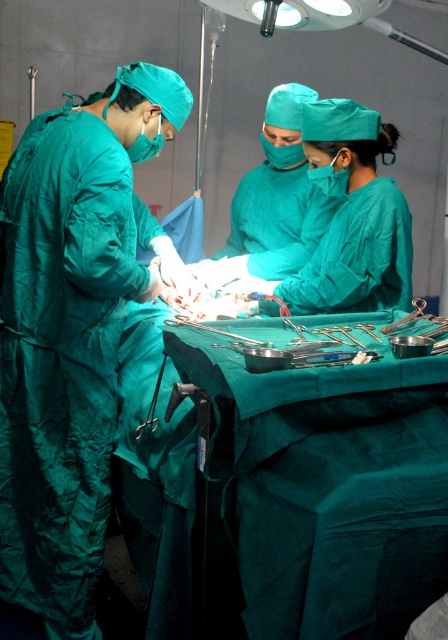
You are a medical student observing the surgery. The teal matte green surgical gown at left is located at point (73, 330). Where is the teal matte green surgical gown at left in relation to the operating table?

The teal matte green surgical gown at left is located at point (73, 330), which is to the left of the operating table.